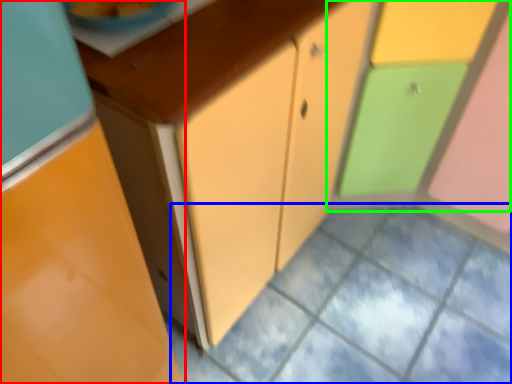
Question: Which object is the farthest from cabinetry (highlighted by a red box)? Choose among these: square (highlighted by a blue box) or cabinetry (highlighted by a green box).

Choices:
 (A) square
 (B) cabinetry

Answer: (B)